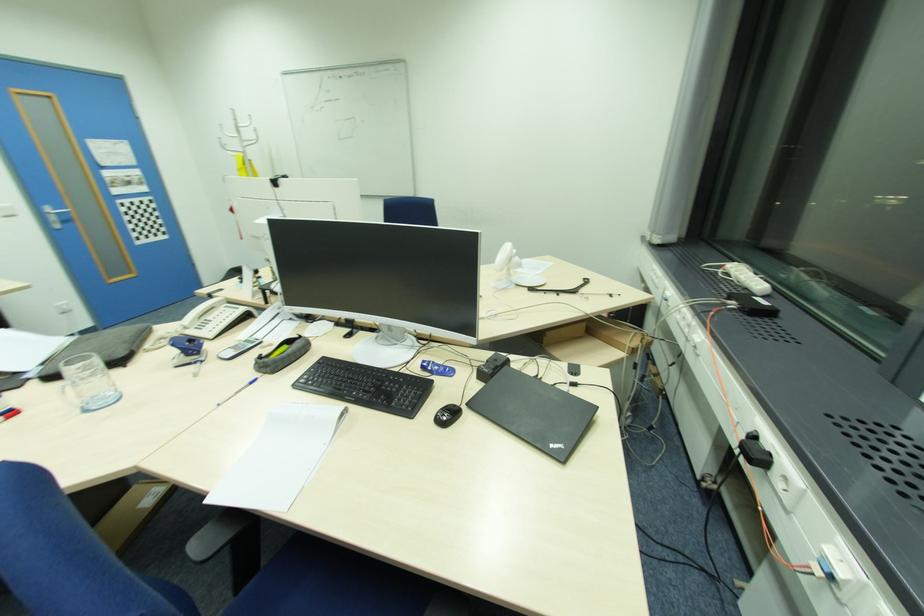
The height and width of the screenshot is (616, 924). Identify the location of telephone handset. (202, 309).